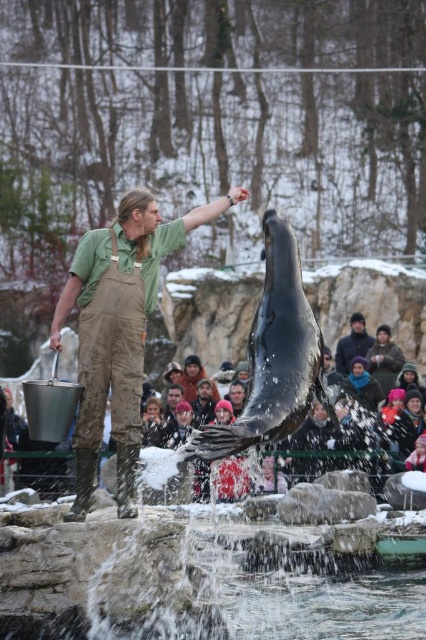
Question: Which of the following is the farthest from the observer?

Choices:
 (A) green cotton shirt at center
 (B) dark brown leather jacket at center

Answer: (B)

Question: Which point is farther to the camera?

Choices:
 (A) (328, 356)
 (B) (111, 400)

Answer: (A)

Question: Is green cotton shirt at center to the right of dark brown leather jacket at center from the viewer's perspective?

Choices:
 (A) yes
 (B) no

Answer: (B)

Question: Which of these objects is positioned closest to the matte brown fur at center?

Choices:
 (A) green cotton shirt at center
 (B) dark brown leather jacket at center

Answer: (B)

Question: Is green cotton shirt at center bigger than dark brown leather jacket at center?

Choices:
 (A) no
 (B) yes

Answer: (B)

Question: Is green cotton shirt at center positioned in front of dark brown leather jacket at center?

Choices:
 (A) no
 (B) yes

Answer: (B)